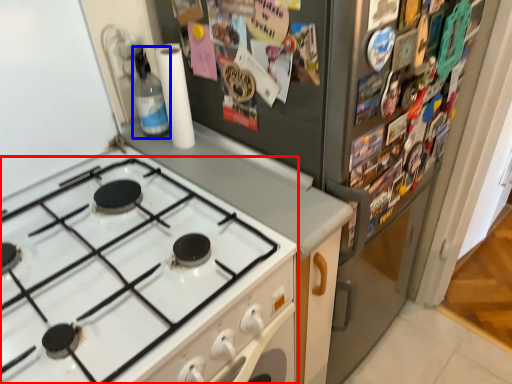
Question: Among these objects, which one is farthest to the camera, gas stove (highlighted by a red box) or bottle (highlighted by a blue box)?

Choices:
 (A) gas stove
 (B) bottle

Answer: (B)